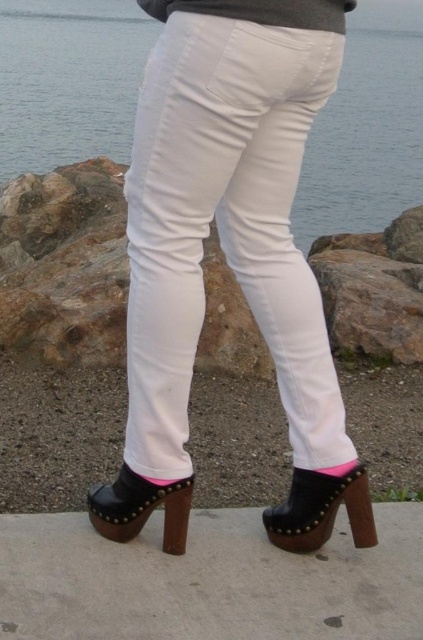
You are a fashion designer examining a model wearing the white cotton pants at center and the black studded platform shoe at lower center. From the model facing forward, which item is positioned to the left side?

The white cotton pants at center are positioned to the left of the black studded platform shoe at lower center.

You are a hiker who just arrived at a scenic spot. You see a clear blue water at center located at point [68,80]. Can you confirm if this point is the center of the image?

Yes, the clear blue water at center is located exactly at point [68,80], which is the center of the image.

You are a photographer trying to capture the black studded platform shoe at lower center. The scene is set in a natural outdoor area with rocks. To ensure the shoe is the main focus, where should you position your camera relative to the point marked at coordinates (321, 509)?

The point at coordinates (321, 509) indicates the location of the black studded platform shoe at lower center. To make the shoe the main focus, position your camera directly facing this point to ensure it is centered and prominent in the frame.